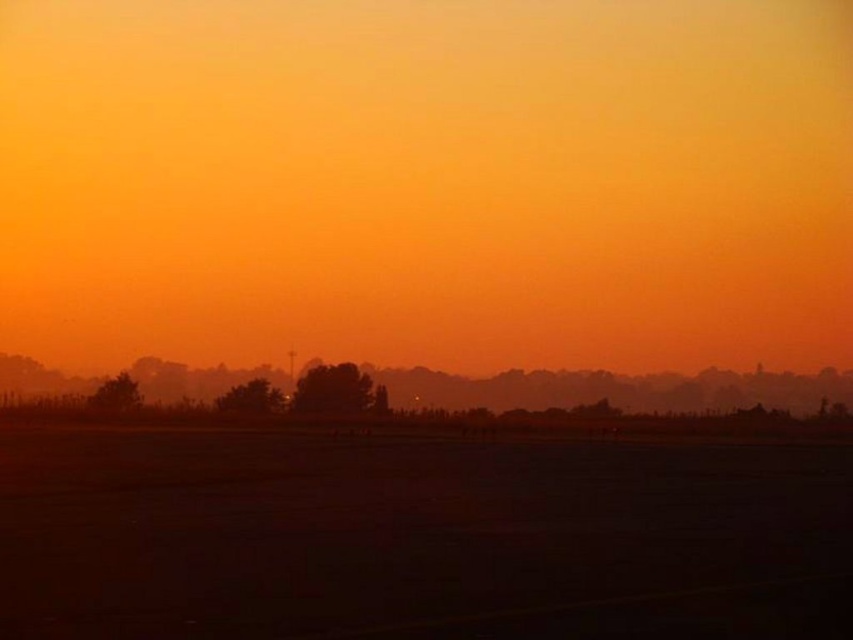
Who is positioned more to the right, dark matte tarmac at center or foggy horizon at center?

From the viewer's perspective, foggy horizon at center appears more on the right side.

Which is above, dark matte tarmac at center or foggy horizon at center?

Positioned higher is dark matte tarmac at center.

Describe the element at coordinates (419, 538) in the screenshot. I see `dark matte tarmac at center` at that location.

Identify the location of dark matte tarmac at center. (419, 538).